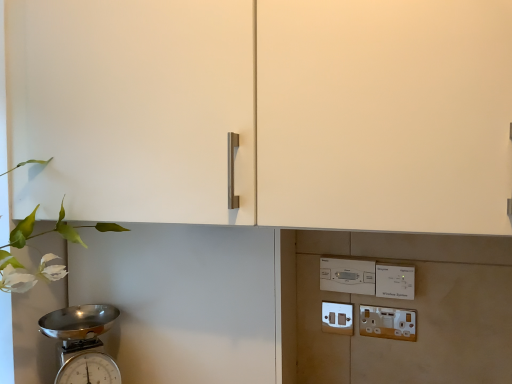
Question: Considering the positions of matte white switch at lower center, which appears as the 2th electric outlet when viewed from the right, and white plastic electric outlet at lower right, which is the second electric outlet in left-to-right order, in the image, is matte white switch at lower center, which appears as the 2th electric outlet when viewed from the right, wider or thinner than white plastic electric outlet at lower right, which is the second electric outlet in left-to-right order,?

Choices:
 (A) thin
 (B) wide

Answer: (B)

Question: From a real-world perspective, is matte white switch at lower center, the first electric outlet in the back-to-front sequence, positioned above or below white plastic electric outlet at lower right, positioned as the 1th electric outlet in front-to-back order?

Choices:
 (A) below
 (B) above

Answer: (B)

Question: Considering the real-world distances, which object is farthest from the matte white switch at lower center, which appears as the 2th electric outlet when viewed from the right?

Choices:
 (A) white plastic electric outlet at lower right, which is the second electric outlet in left-to-right order
 (B) white plastic light switch at lower right, arranged as the 2th light switch when viewed from the left
 (C) shiny metallic scale at lower left
 (D) white plastic light switch at center, which is counted as the first light switch, starting from the left

Answer: (C)

Question: Which is farther from the white plastic electric outlet at lower right, which is the second electric outlet in left-to-right order?

Choices:
 (A) white plastic light switch at center, which is counted as the first light switch, starting from the left
 (B) matte white switch at lower center, which appears as the 2th electric outlet when viewed from the right
 (C) white plastic light switch at lower right, the first light switch positioned from the right
 (D) shiny metallic scale at lower left

Answer: (D)